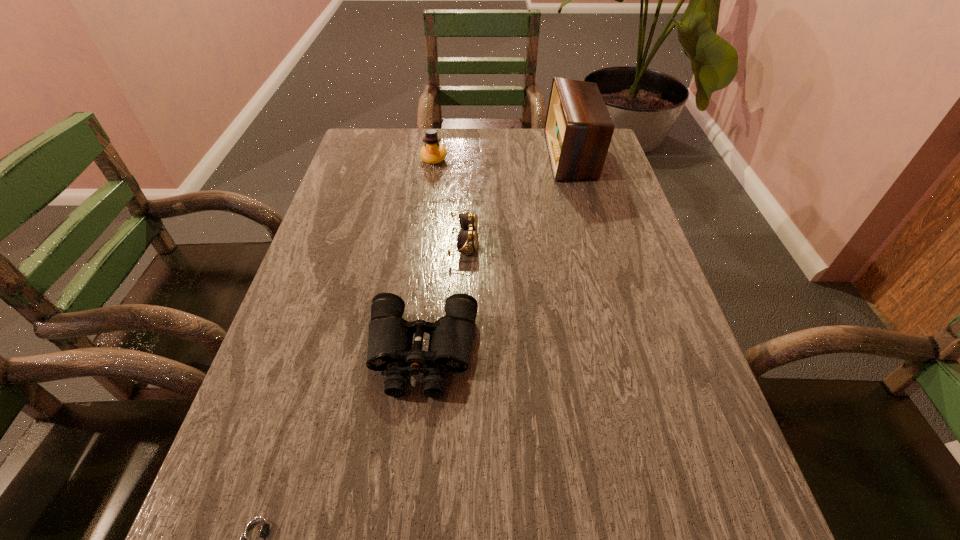
You are a GUI agent. You are given a task and a screenshot of the screen. Output one action in this format:
    pyautogui.click(x=<x>, y=<y>)
    Task: Click on the free spot located 0.130m through the eyepieces of the binoculars
    
    Given the screenshot: What is the action you would take?
    (410, 470)

Find the location of a particular element. The width and height of the screenshot is (960, 540). vacant point located through the lenses of the third nearest object is located at coordinates (627, 241).

The width and height of the screenshot is (960, 540). I want to click on radio receiver that is at the far edge, so click(578, 129).

Identify the location of duck present at the far edge. The width and height of the screenshot is (960, 540). (433, 152).

Find the location of a particular element. This screenshot has height=540, width=960. object that is at the right edge is located at coordinates (578, 129).

Find the location of `object located in the far right corner section of the desktop`. object located in the far right corner section of the desktop is located at coordinates (578, 129).

Find the location of `free space at the far edge of the desktop`. free space at the far edge of the desktop is located at coordinates (479, 132).

Identify the location of vacant space at the left edge of the desktop. The height and width of the screenshot is (540, 960). (336, 208).

In the image, there is a desktop. Find the location of `blank space at the right edge`. blank space at the right edge is located at coordinates (583, 223).

Where is `vacant area that lies between the tallest object and the second tallest object`? vacant area that lies between the tallest object and the second tallest object is located at coordinates (503, 157).